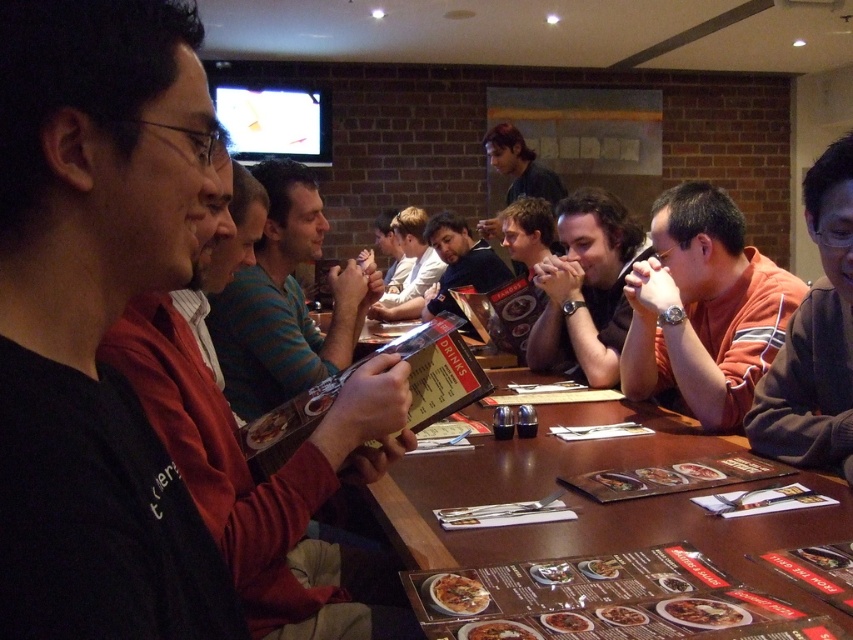
Question: Is dark brown hair at upper center to the right of smooth brown shirt at center from the viewer's perspective?

Choices:
 (A) no
 (B) yes

Answer: (B)

Question: Based on their relative distances, which object is nearer to the light brown striped shirt at center?

Choices:
 (A) matte red sweater at left
 (B) brown wooden table at center
 (C) smooth brown leather jacket at center
 (D) orange striped shirt at center

Answer: (C)

Question: Is striped cotton shirt at center bigger than smooth brown shirt at center?

Choices:
 (A) no
 (B) yes

Answer: (A)

Question: Among these points, which one is farthest from the camera?

Choices:
 (A) (427, 300)
 (B) (556, 353)
 (C) (190, 81)

Answer: (A)

Question: Which object is closer to the camera taking this photo?

Choices:
 (A) smooth brown shirt at center
 (B) dark brown sweater at center

Answer: (B)

Question: Does brown wooden table at center have a larger size compared to light brown striped shirt at center?

Choices:
 (A) no
 (B) yes

Answer: (A)